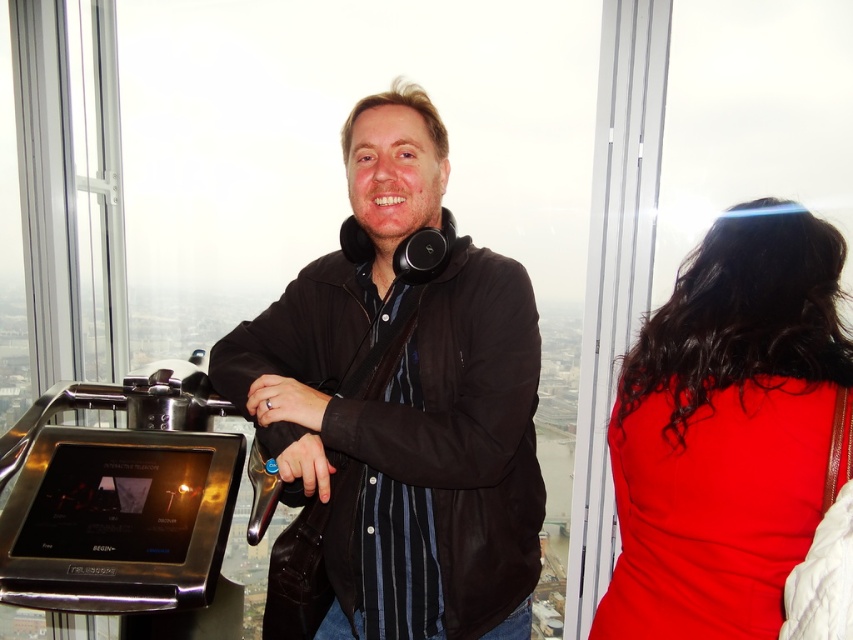
Question: In this image, where is black matte jacket at center located relative to shiny red dress at right?

Choices:
 (A) right
 (B) left

Answer: (B)

Question: Which point is farther from the camera taking this photo?

Choices:
 (A) (692, 369)
 (B) (393, 106)

Answer: (A)

Question: Which point appears farthest from the camera in this image?

Choices:
 (A) (769, 362)
 (B) (283, 417)

Answer: (A)

Question: Which point is farther to the camera?

Choices:
 (A) (490, 349)
 (B) (728, 272)

Answer: (B)

Question: Can you confirm if black matte jacket at center is wider than shiny red dress at right?

Choices:
 (A) no
 (B) yes

Answer: (A)

Question: Does black matte jacket at center appear on the right side of shiny red dress at right?

Choices:
 (A) yes
 (B) no

Answer: (B)